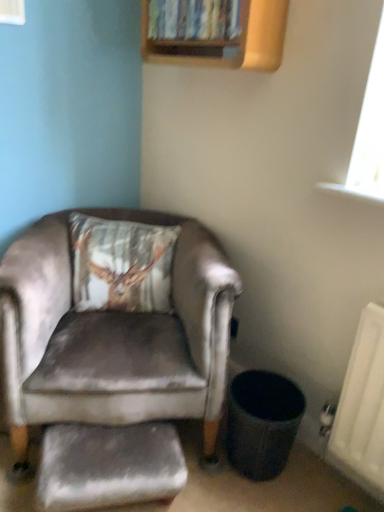
Question: From the image's perspective, is transparent glass window at upper left beneath velvet grey footrest at lower left?

Choices:
 (A) no
 (B) yes

Answer: (A)

Question: Can you confirm if transparent glass window at upper left is bigger than velvet grey footrest at lower left?

Choices:
 (A) no
 (B) yes

Answer: (A)

Question: From a real-world perspective, does transparent glass window at upper left sit lower than velvet grey footrest at lower left?

Choices:
 (A) no
 (B) yes

Answer: (A)

Question: Does transparent glass window at upper left have a lesser width compared to velvet grey footrest at lower left?

Choices:
 (A) no
 (B) yes

Answer: (B)

Question: Could you tell me if transparent glass window at upper left is turned towards velvet grey footrest at lower left?

Choices:
 (A) yes
 (B) no

Answer: (B)

Question: Is transparent glass window at upper left wider than velvet grey footrest at lower left?

Choices:
 (A) no
 (B) yes

Answer: (A)

Question: Can you confirm if velvet-like brown pillow at upper left is smaller than transparent glass window at upper left?

Choices:
 (A) no
 (B) yes

Answer: (A)

Question: Is velvet-like brown pillow at upper left touching transparent glass window at upper left?

Choices:
 (A) yes
 (B) no

Answer: (B)

Question: From the image's perspective, is velvet-like brown pillow at upper left above transparent glass window at upper left?

Choices:
 (A) no
 (B) yes

Answer: (A)

Question: Can you confirm if velvet-like brown pillow at upper left is bigger than transparent glass window at upper left?

Choices:
 (A) no
 (B) yes

Answer: (B)

Question: Is velvet-like brown pillow at upper left not inside transparent glass window at upper left?

Choices:
 (A) no
 (B) yes

Answer: (B)

Question: From a real-world perspective, is velvet-like brown pillow at upper left positioned under transparent glass window at upper left based on gravity?

Choices:
 (A) yes
 (B) no

Answer: (A)

Question: Is satin grey armchair at left in front of velvet-like brown pillow at upper left?

Choices:
 (A) yes
 (B) no

Answer: (A)